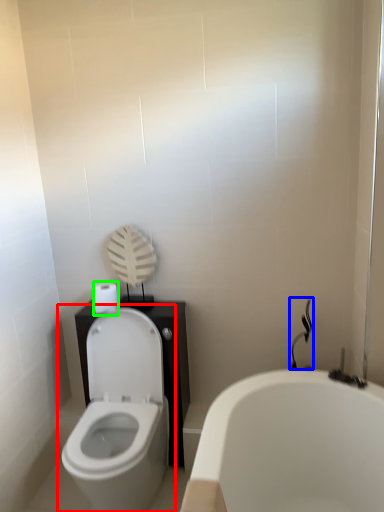
Question: Which object is positioned farthest from toilet (highlighted by a red box)? Select from shower (highlighted by a blue box) and toilet paper (highlighted by a green box).

Choices:
 (A) shower
 (B) toilet paper

Answer: (A)